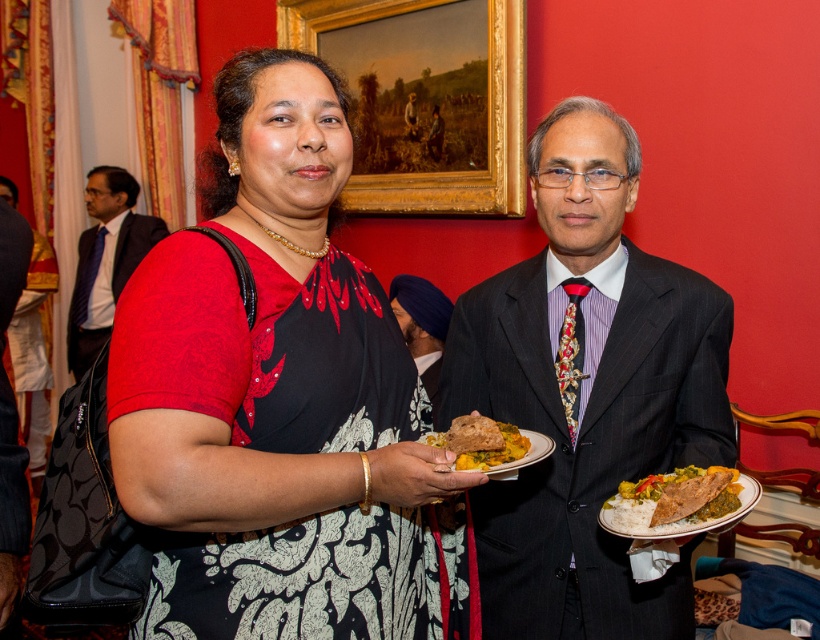
Question: Is white rice with curry and bread at center positioned before blue turban at center?

Choices:
 (A) no
 (B) yes

Answer: (B)

Question: Which of these objects is positioned closest to the dark blue suit at left?

Choices:
 (A) matte black dress at center
 (B) dark gray suit at center
 (C) goldwooden frame at upper center
 (D) golden brown bread at center

Answer: (C)

Question: Considering the real-world distances, which object is farthest from the dark blue suit at left?

Choices:
 (A) golden brown bread at center
 (B) blue turban at center
 (C) goldwooden frame at upper center
 (D) dark gray suit at center

Answer: (A)

Question: Among these points, which one is farthest from the camera?

Choices:
 (A) (340, 593)
 (B) (639, 531)

Answer: (B)

Question: Is dark blue suit at left above golden brown bread at center?

Choices:
 (A) no
 (B) yes

Answer: (B)

Question: Is dark blue suit at left wider than golden brown bread at center?

Choices:
 (A) yes
 (B) no

Answer: (A)